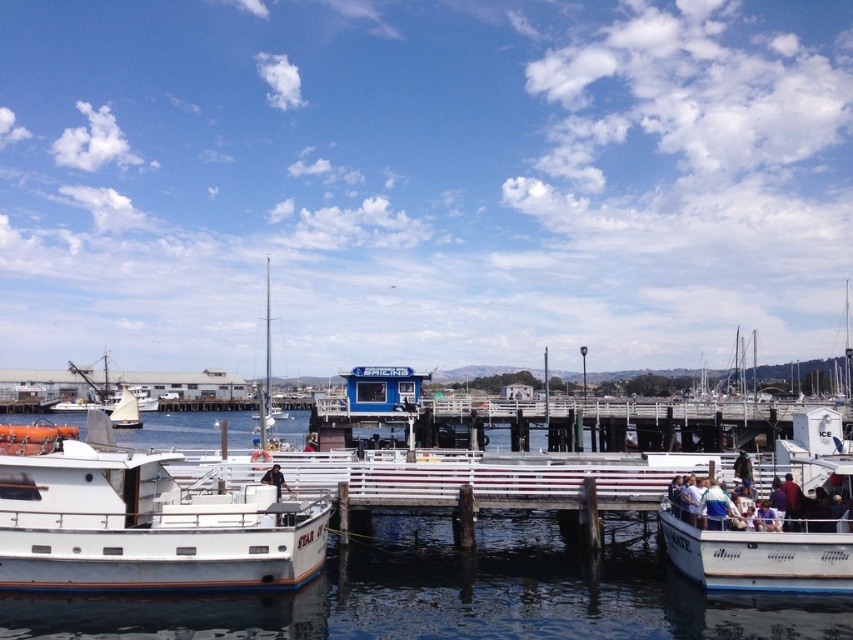
Question: Which is nearer to the white glossy boat at left?

Choices:
 (A) black fabric jacket at center
 (B) white glossy water at center
 (C) white matte boat at lower right
 (D) white fabric people at lower right

Answer: (A)

Question: In this image, where is white matte boat at lower right located relative to black fabric jacket at center?

Choices:
 (A) left
 (B) right

Answer: (B)

Question: Which object is the farthest from the white sailboat at left?

Choices:
 (A) black fabric jacket at center
 (B) white fabric people at lower right

Answer: (B)

Question: Is white fabric people at lower right thinner than black fabric jacket at center?

Choices:
 (A) yes
 (B) no

Answer: (B)

Question: Can you confirm if white fabric people at lower right is wider than black fabric jacket at center?

Choices:
 (A) yes
 (B) no

Answer: (A)

Question: Which point is closer to the camera taking this photo?

Choices:
 (A) (277, 497)
 (B) (724, 513)

Answer: (B)